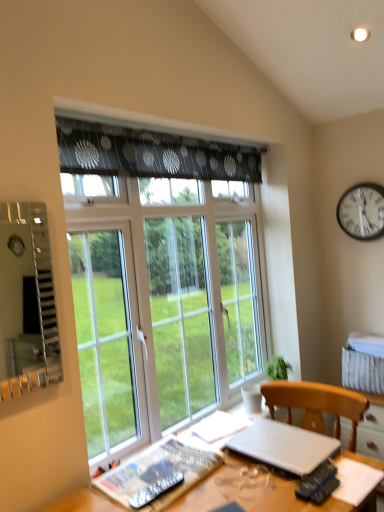
This screenshot has width=384, height=512. Identify the location of spots to the right of metallic silver remote at lower center. (201, 487).